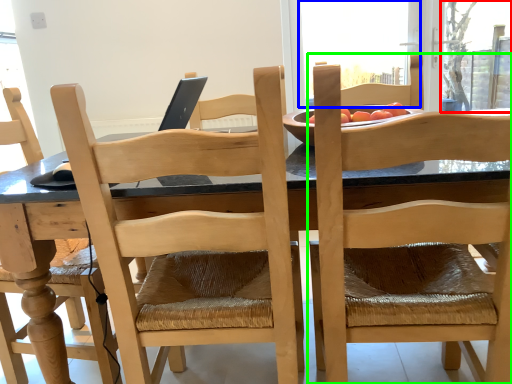
Question: Considering the real-world distances, which object is farthest from window screen (highlighted by a red box)? window screen (highlighted by a blue box) or chair (highlighted by a green box)?

Choices:
 (A) window screen
 (B) chair

Answer: (B)